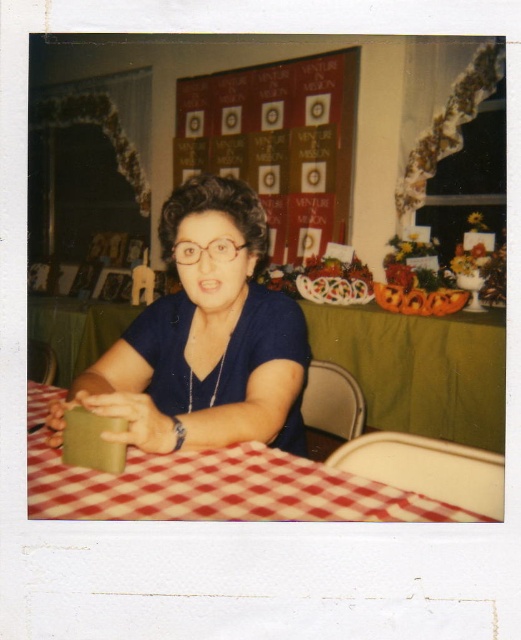
Question: Is blue fabric shirt at center bigger than green fabric table at center?

Choices:
 (A) no
 (B) yes

Answer: (A)

Question: Can you confirm if green fabric table at center is positioned above clear plastic glasses at center?

Choices:
 (A) no
 (B) yes

Answer: (A)

Question: Which object is positioned closest to the red checkered tablecloth at center?

Choices:
 (A) green fabric table at center
 (B) clear plastic glasses at center
 (C) blue fabric shirt at center

Answer: (C)

Question: Does blue fabric shirt at center appear over clear plastic glasses at center?

Choices:
 (A) no
 (B) yes

Answer: (A)

Question: Among these objects, which one is nearest to the camera?

Choices:
 (A) blue fabric shirt at center
 (B) clear plastic glasses at center
 (C) maroon fabric bulletin board at upper center
 (D) red checkered tablecloth at center

Answer: (D)

Question: Estimate the real-world distances between objects in this image. Which object is closer to the green fabric table at center?

Choices:
 (A) maroon fabric bulletin board at upper center
 (B) blue fabric shirt at center

Answer: (A)